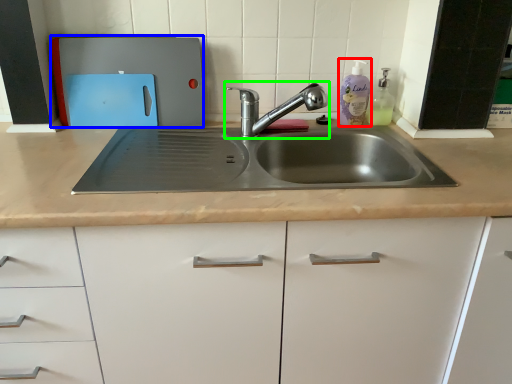
Question: Considering the real-world distances, which object is farthest from cleaning product (highlighted by a red box)? appliance (highlighted by a blue box) or tap (highlighted by a green box)?

Choices:
 (A) appliance
 (B) tap

Answer: (A)